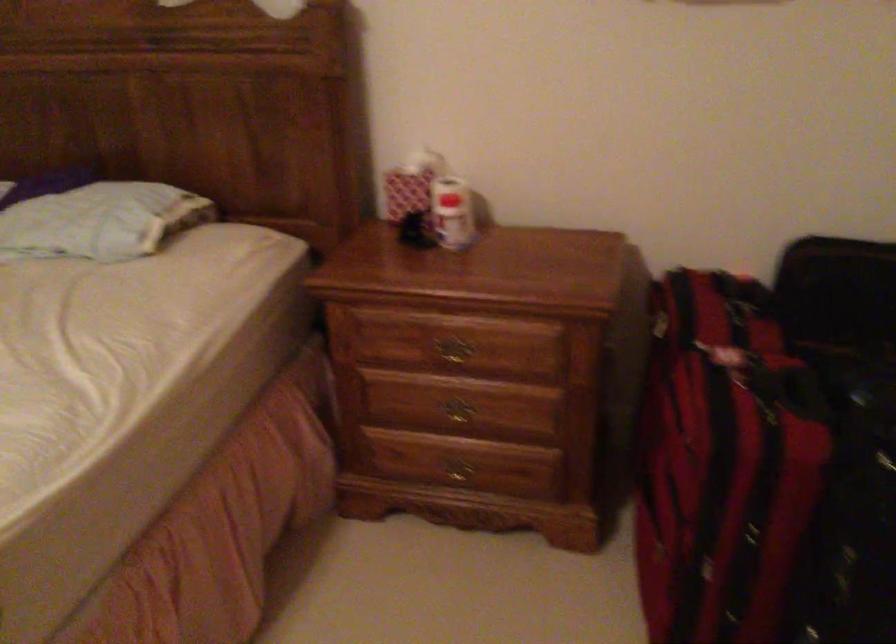
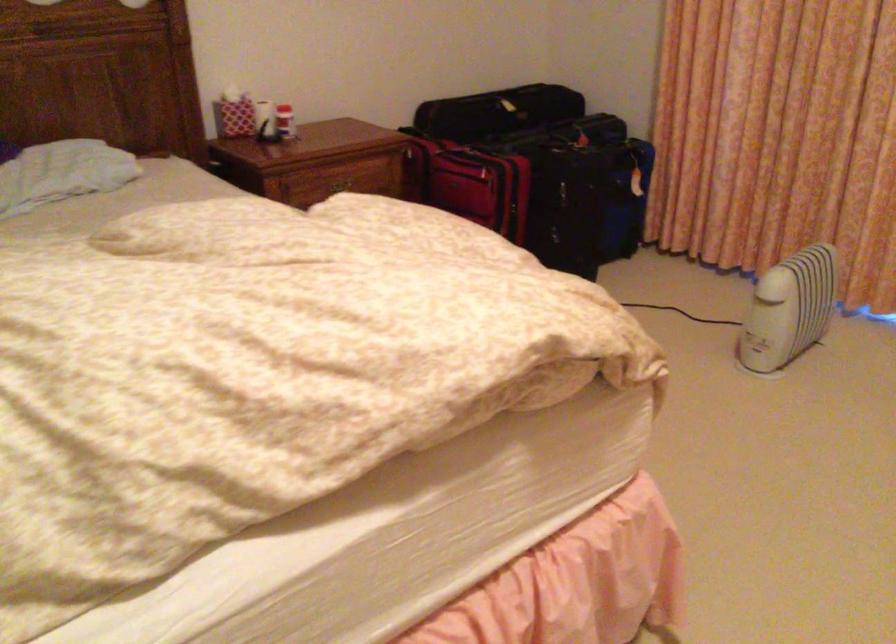
Find the pixel in the second image that matches [469,343] in the first image.

(338, 185)